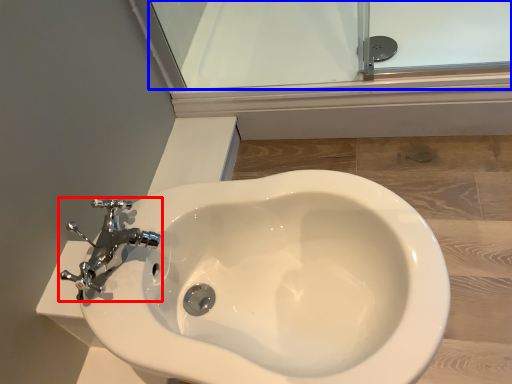
Question: Which point is further to the camera, tap (highlighted by a red box) or glass door (highlighted by a blue box)?

Choices:
 (A) tap
 (B) glass door

Answer: (B)